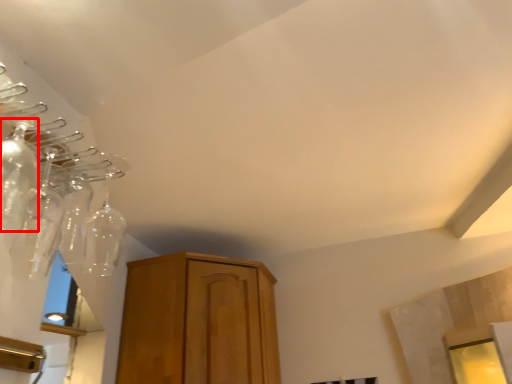
Question: In this image, where is glass bottle (annotated by the red box) located relative to glass bottle?

Choices:
 (A) right
 (B) left

Answer: (B)